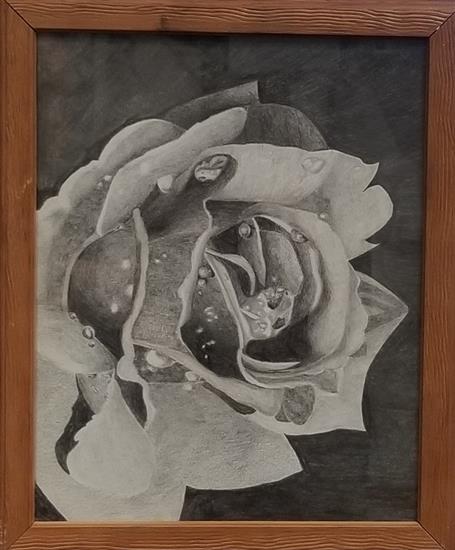
I want to click on top left corner of picture frame, so click(2, 0).